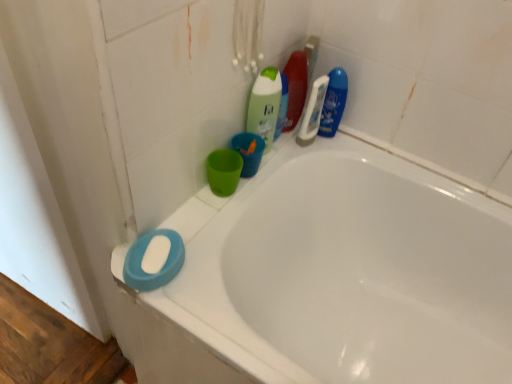
The width and height of the screenshot is (512, 384). I want to click on empty space that is in between white plastic toothbrush at upper center, the third cleaning product when ordered from left to right, and white matte soap at lower left, so click(241, 197).